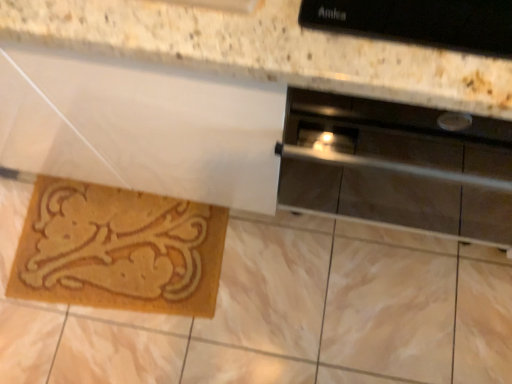
Find the location of a particular element. The height and width of the screenshot is (384, 512). vacant point above natural fiber mat at lower left (from a real-world perspective) is located at coordinates (117, 248).